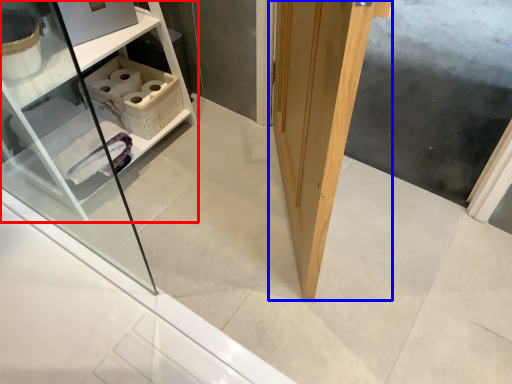
Question: Which object is further to the camera taking this photo, shelf (highlighted by a red box) or door (highlighted by a blue box)?

Choices:
 (A) shelf
 (B) door

Answer: (A)